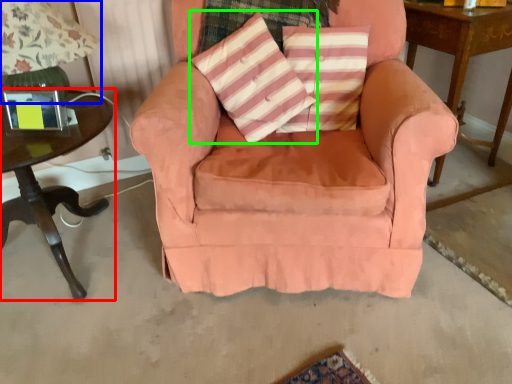
Question: Considering the real-world distances, which object is closest to table (highlighted by a red box)? table lamp (highlighted by a blue box) or throw pillow (highlighted by a green box).

Choices:
 (A) table lamp
 (B) throw pillow

Answer: (A)